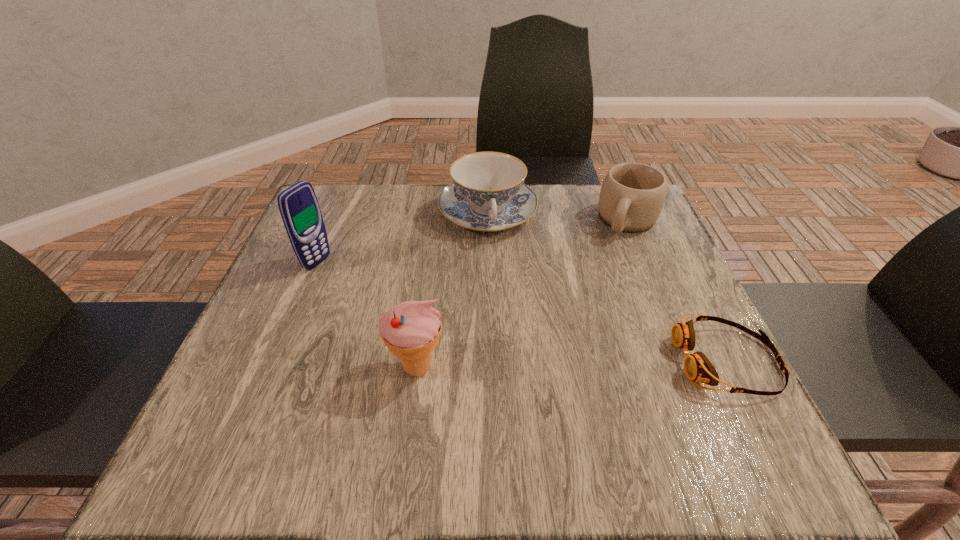
Where is `vacant space on the desktop that is between the icecream and the goggles and is positioned on the front-facing side of the third nearest object`? Image resolution: width=960 pixels, height=540 pixels. vacant space on the desktop that is between the icecream and the goggles and is positioned on the front-facing side of the third nearest object is located at coordinates (548, 364).

Locate an element on the screen. vacant space on the desktop that is between the icecream and the shortest object and is positioned on the side of the mug with the handle is located at coordinates (548, 364).

This screenshot has height=540, width=960. What are the coordinates of `vacant spot on the desktop that is between the icecream and the shortest object and is positioned with the handle on the side of the chinaware` in the screenshot? It's located at (532, 365).